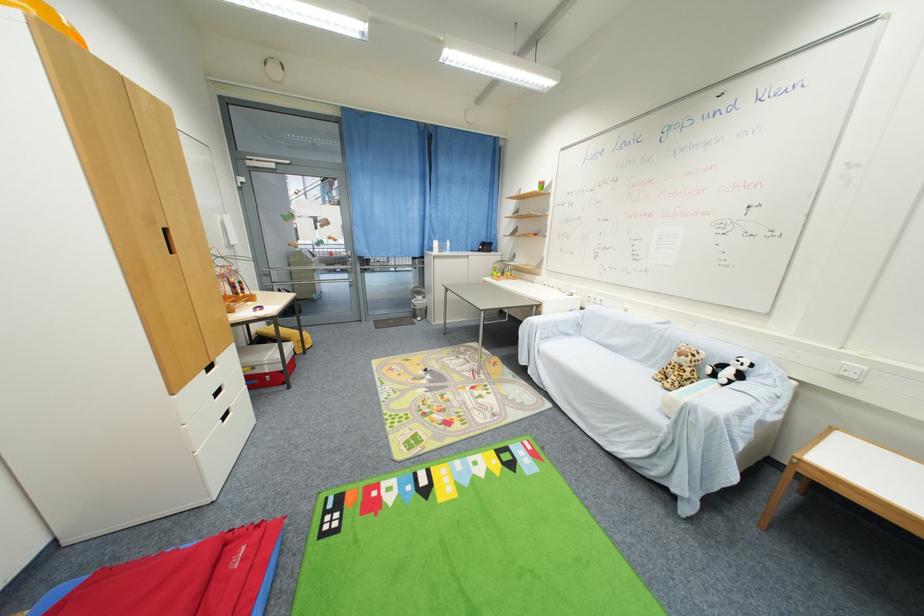
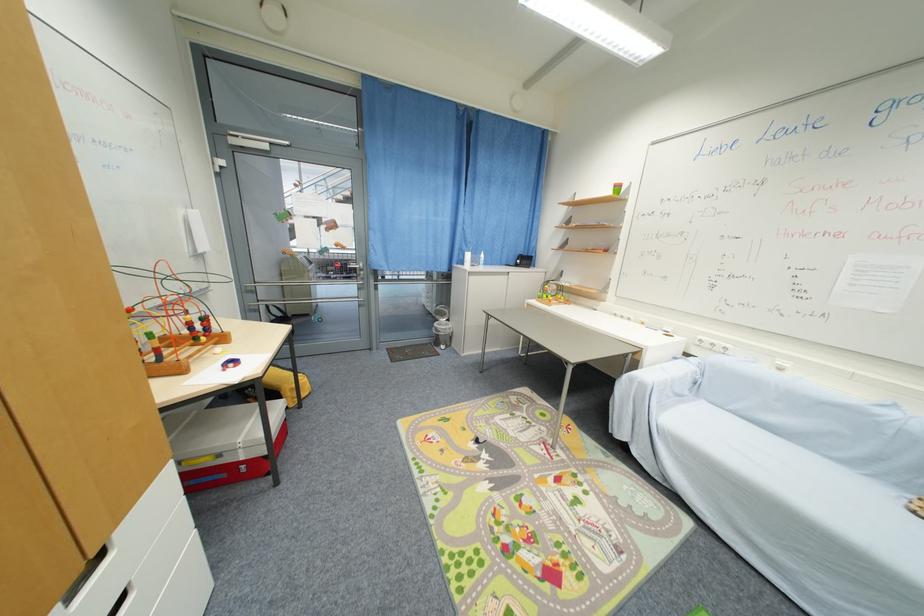
The point at (602, 304) is marked in the first image. Where is the corresponding point in the second image?

(723, 351)